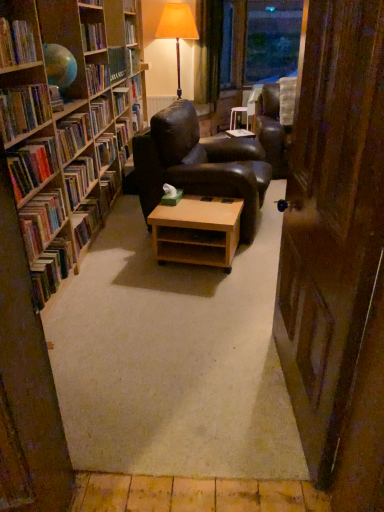
Question: Looking at the image, does hardcover books at left, which is counted as the 6th book, starting from the top, seem bigger or smaller compared to hardcover books at left, the fifth book viewed from the top?

Choices:
 (A) big
 (B) small

Answer: (B)

Question: From their relative heights in the image, would you say hardcover books at left, which is counted as the 6th book, starting from the top, is taller or shorter than hardcover books at left, the 5th book in the bottom-to-top sequence?

Choices:
 (A) tall
 (B) short

Answer: (B)

Question: Considering the real-world distances, which object is closest to the wooden side table at center?

Choices:
 (A) hardcover book at left, marked as the 6th book in a bottom-to-top arrangement
 (B) hardcover books at left, marked as the 4th book in a bottom-to-top arrangement
 (C) matte brown table lamp at center
 (D) light brown wooden table at center
 (E) green velvet curtain at upper center

Answer: (E)

Question: Which object is positioned closest to the hardcover book at left, the second book when ordered from bottom to top?

Choices:
 (A) wooden bookshelf at left
 (B) hardcover books at left, the fifth book viewed from the top
 (C) hardcover book at left, the fourth book positioned from the top
 (D) hardcover book at left, the ninth book in the top-to-bottom sequence
 (E) hardcover book at left, which is the 9th book from bottom to top

Answer: (D)